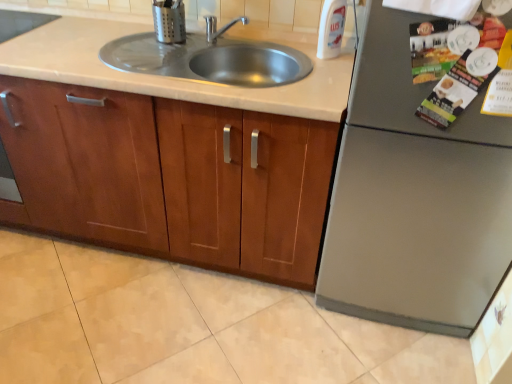
Find the location of `vacant area on top of beige tile floor at lower center (from a real-world perspective)`. vacant area on top of beige tile floor at lower center (from a real-world perspective) is located at coordinates (177, 309).